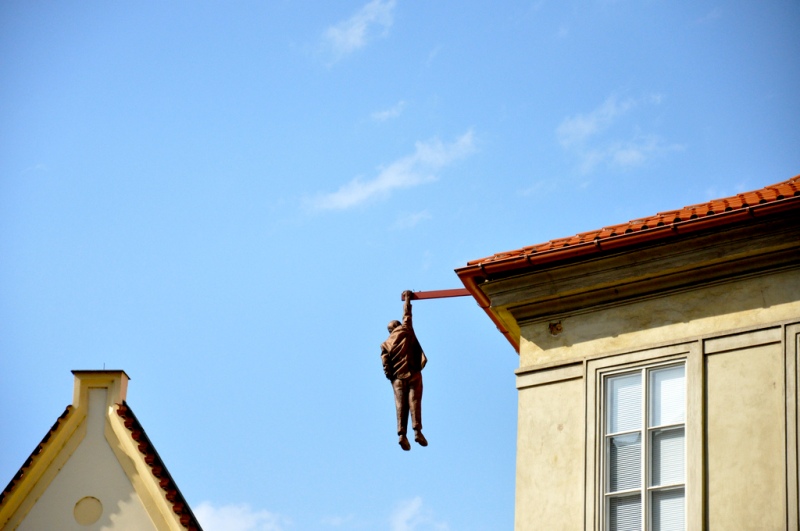
Image resolution: width=800 pixels, height=531 pixels. Identify the location of windows. (676, 466).